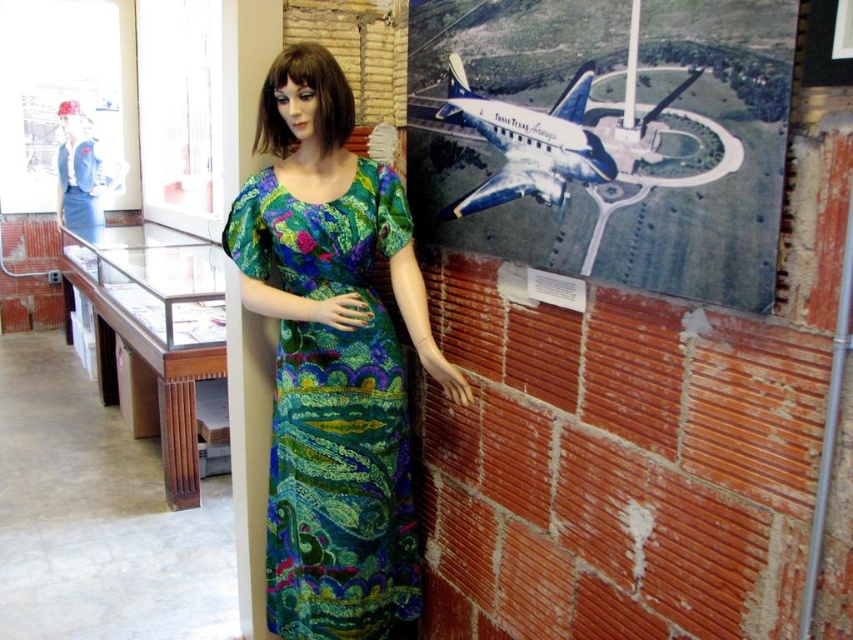
Question: Which point is farther to the camera?

Choices:
 (A) (256, 260)
 (B) (717, 92)

Answer: (A)

Question: Is metallic airplane at upper right thinner than multicolored printed fabric dress at center?

Choices:
 (A) no
 (B) yes

Answer: (A)

Question: Can you confirm if metallic airplane at upper right is positioned below multicolored printed fabric dress at center?

Choices:
 (A) yes
 (B) no

Answer: (B)

Question: Is the position of metallic airplane at upper right less distant than that of multicolored printed fabric dress at center?

Choices:
 (A) no
 (B) yes

Answer: (B)